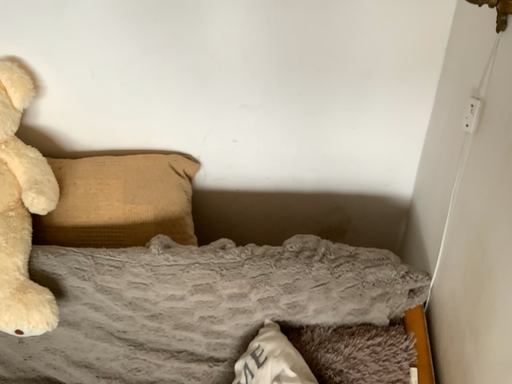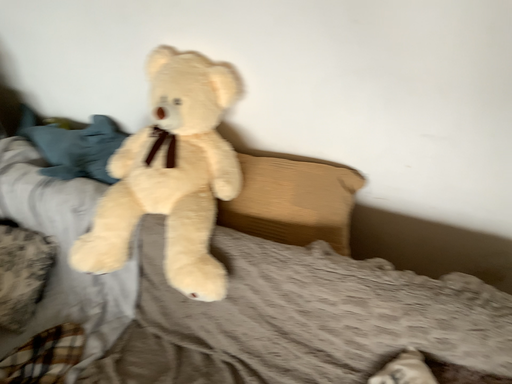
Question: How did the camera likely rotate when shooting the video?

Choices:
 (A) rotated left
 (B) rotated right

Answer: (A)